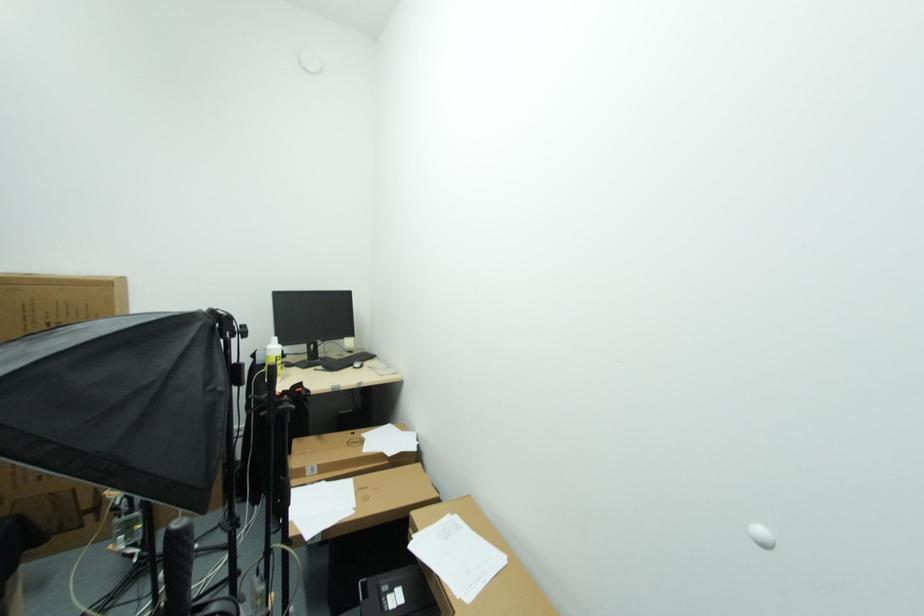
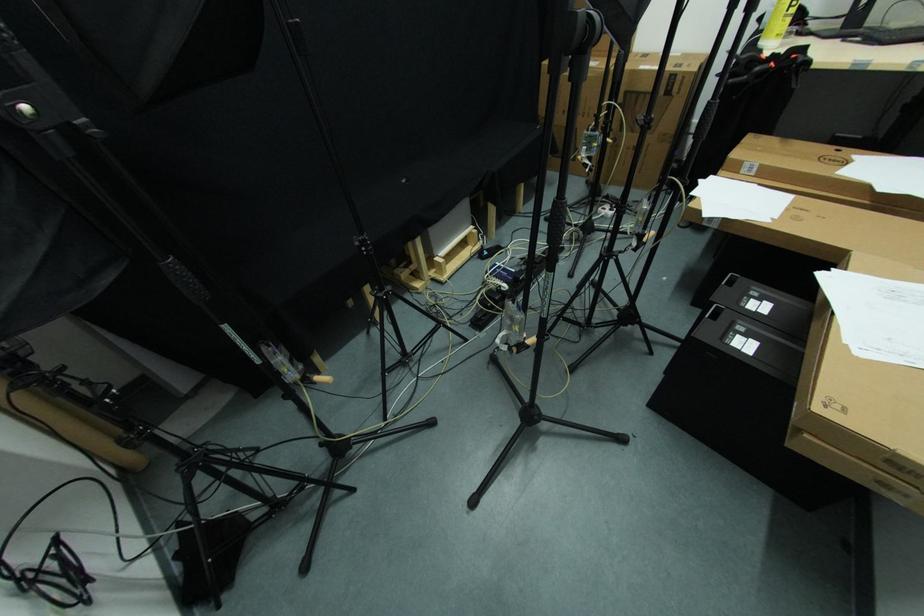
Where in the second image is the point corresponding to (414,541) from the first image?

(830, 273)